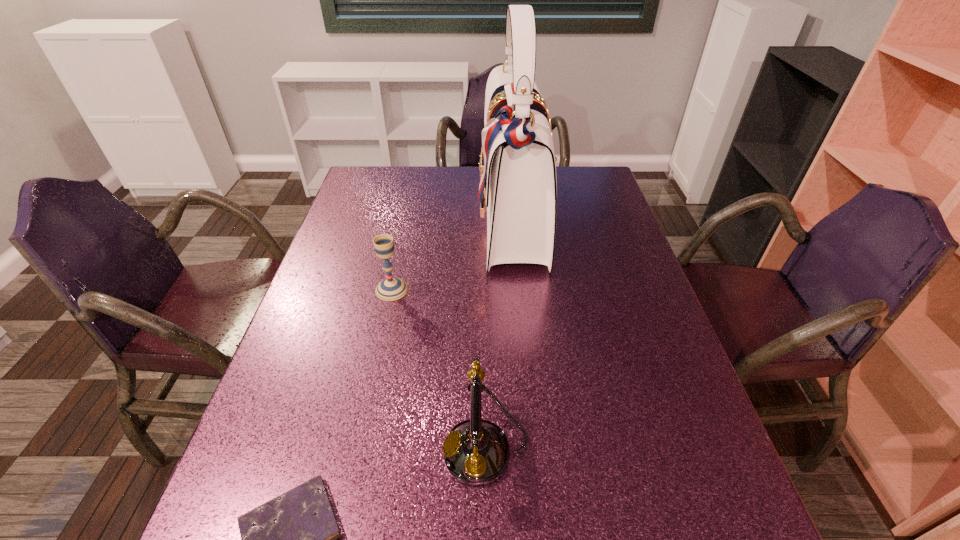
The width and height of the screenshot is (960, 540). In order to click on object present at the far edge in this screenshot , I will do `click(517, 166)`.

Find the location of a particular element. This screenshot has height=540, width=960. free region at the far edge is located at coordinates (461, 171).

Image resolution: width=960 pixels, height=540 pixels. What are the coordinates of `vacant space at the left edge of the desktop` in the screenshot? It's located at coord(245,499).

The height and width of the screenshot is (540, 960). In the image, there is a desktop. In order to click on vacant space at the right edge in this screenshot , I will do `click(664, 501)`.

This screenshot has height=540, width=960. I want to click on vacant space at the far left corner of the desktop, so click(392, 203).

In order to click on vacant space at the far right corner of the desktop in this screenshot , I will do `click(584, 171)`.

This screenshot has height=540, width=960. I want to click on vacant area that lies between the telephone and the satchel, so click(x=500, y=335).

Find the location of a particular element. Image resolution: width=960 pixels, height=540 pixels. vacant area that lies between the tallest object and the telephone is located at coordinates (500, 335).

The image size is (960, 540). I want to click on vacant space in between the chalice and the telephone, so click(x=439, y=369).

You are a GUI agent. You are given a task and a screenshot of the screen. Output one action in this format:
    pyautogui.click(x=<x>, y=<y>)
    Task: Click on the vacant area that lies between the telephone and the satchel
    The width and height of the screenshot is (960, 540).
    Given the screenshot: What is the action you would take?
    pyautogui.click(x=500, y=335)